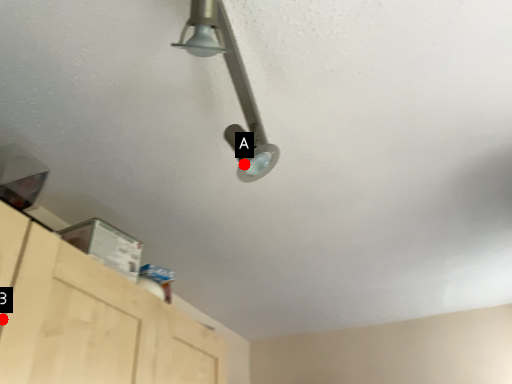
Question: Two points are circled on the image, labeled by A and B beside each circle. Which point is farther from the camera taking this photo?

Choices:
 (A) A is further
 (B) B is further

Answer: (A)